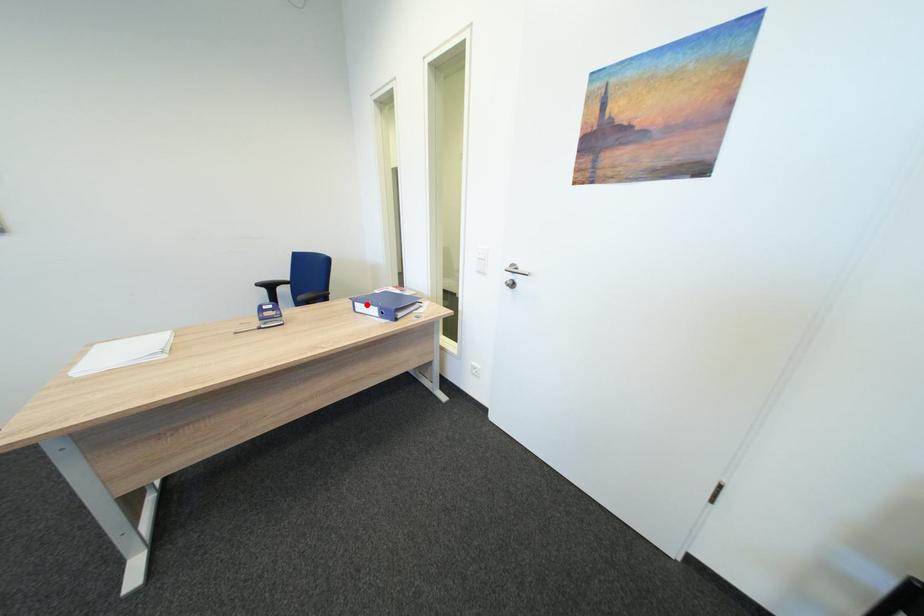
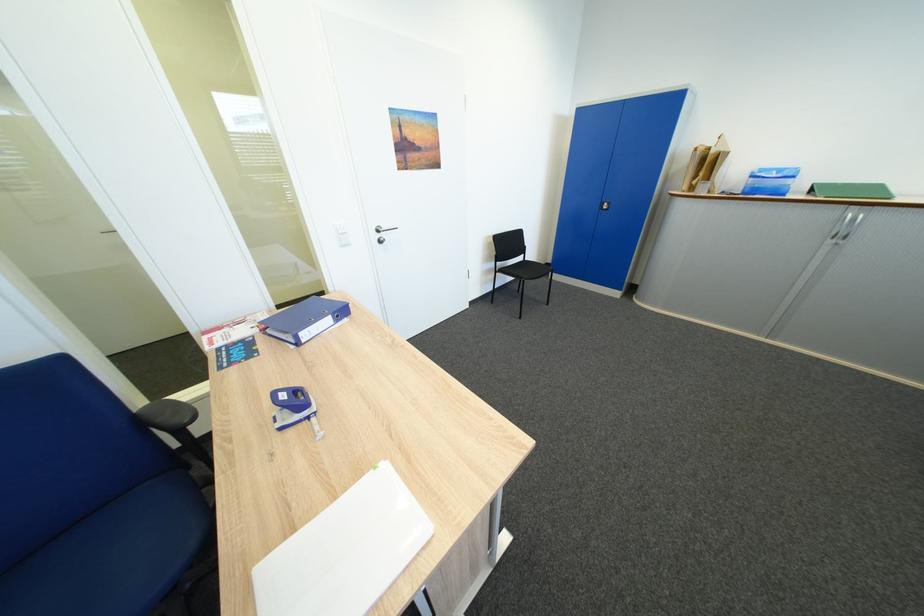
Where in the second image is the point corresponding to the highlighted location from the first image?

(310, 334)